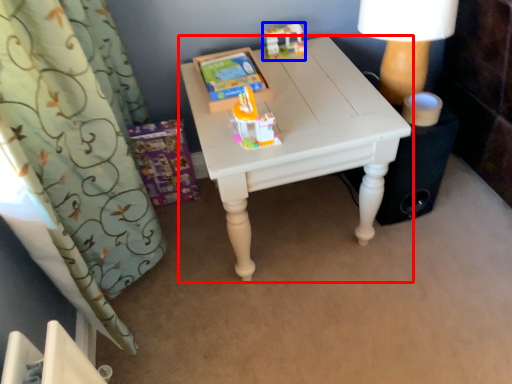
Question: Which object is closer to the camera taking this photo, table (highlighted by a red box) or toy (highlighted by a blue box)?

Choices:
 (A) table
 (B) toy

Answer: (A)